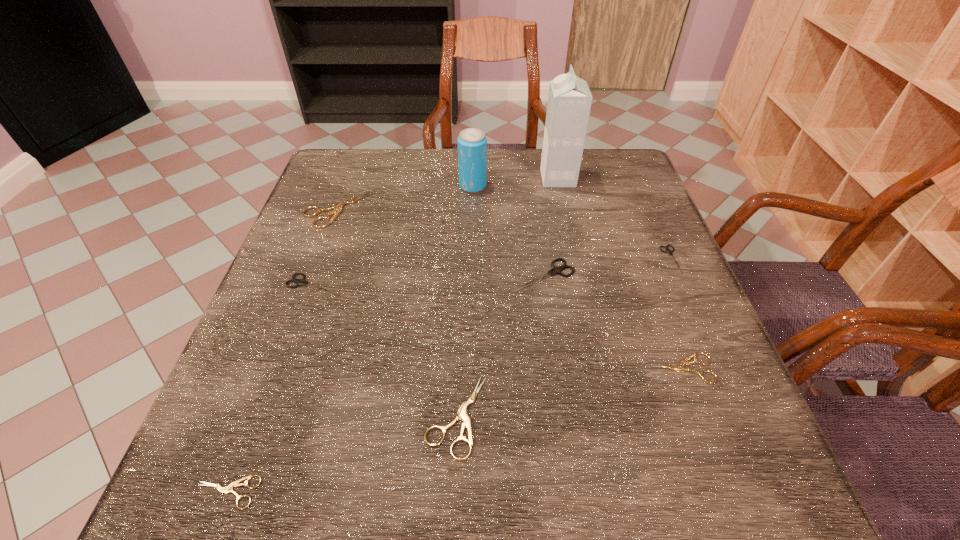
The image size is (960, 540). What are the coordinates of `vacant space located 0.260m on the back of the second beige shears from right to left` in the screenshot? It's located at (462, 272).

In order to click on vacant space situated 0.210m on the back of the rightmost beige shears in this screenshot , I will do `click(645, 272)`.

The width and height of the screenshot is (960, 540). I want to click on blank space located on the left of the smallest black shears, so click(535, 259).

Image resolution: width=960 pixels, height=540 pixels. I want to click on vacant space located on the back of the nearest shears, so click(298, 303).

Identify the location of carton located in the far edge section of the desktop. (569, 103).

Where is `soda can that is at the far edge`? Image resolution: width=960 pixels, height=540 pixels. soda can that is at the far edge is located at coordinates (472, 143).

The height and width of the screenshot is (540, 960). Identify the location of shears located at the far edge. (338, 207).

Where is `object that is at the far left corner`? The height and width of the screenshot is (540, 960). object that is at the far left corner is located at coordinates (338, 207).

This screenshot has height=540, width=960. Identify the location of object that is positioned at the near left corner. (228, 489).

In the image, there is a desktop. At what (x,y) coordinates should I click in order to perform the action: click on free space at the far edge. Please return your answer as a coordinate pair (x, y). The height and width of the screenshot is (540, 960). Looking at the image, I should click on (528, 179).